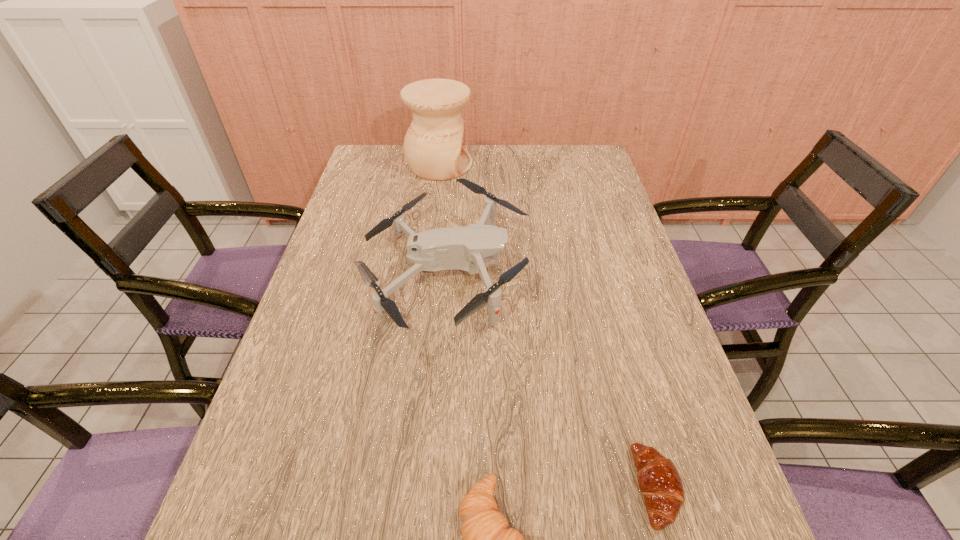
Select which object is the second closest to the left crescent roll. Please provide its 2D coordinates. Your answer should be formatted as a tuple, i.e. [(x, y)], where the tuple contains the x and y coordinates of a point satisfying the conditions above.

[(467, 248)]

I want to click on free space that satisfies the following two spatial constraints: 1. on the back side of the shorter crescent roll; 2. at the open side of the pottery, so click(x=567, y=165).

What are the coordinates of `free location that satisfies the following two spatial constraints: 1. with a camera at the front of the third nearest object; 2. on the back side of the shorter crescent roll` in the screenshot? It's located at (428, 488).

You are a GUI agent. You are given a task and a screenshot of the screen. Output one action in this format:
    pyautogui.click(x=<x>, y=<y>)
    Task: Click on the vacant region that satisfies the following two spatial constraints: 1. with a camera at the front of the second farthest object; 2. on the left side of the right crescent roll
    Image resolution: width=960 pixels, height=540 pixels.
    Given the screenshot: What is the action you would take?
    pyautogui.click(x=428, y=488)